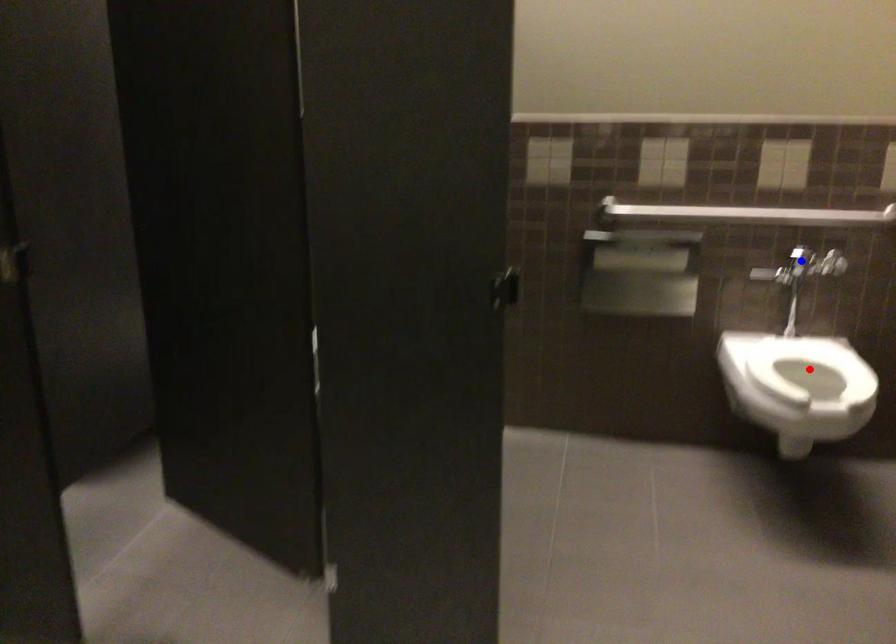
Question: In the image, two points are highlighted. Which point is nearer to the camera? Reply with the corresponding letter.

Choices:
 (A) blue point
 (B) red point

Answer: (B)